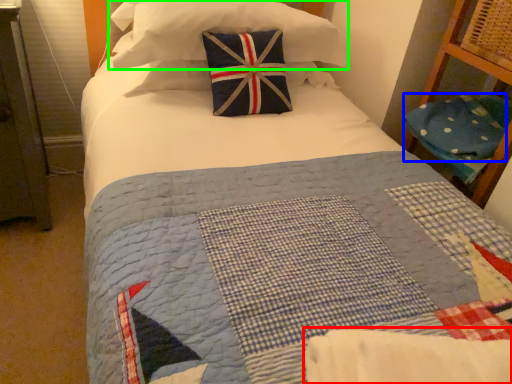
Question: Based on their relative distances, which object is nearer to blanket (highlighted by a red box)? Choose from pillow (highlighted by a blue box) and pillow (highlighted by a green box).

Choices:
 (A) pillow
 (B) pillow

Answer: (A)